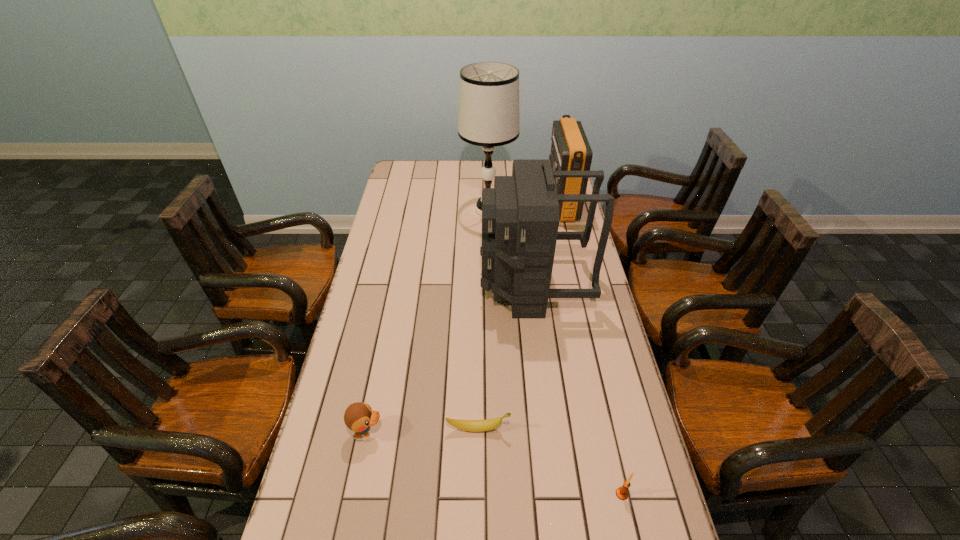
You are a GUI agent. You are given a task and a screenshot of the screen. Output one action in this format:
    pyautogui.click(x=<x>, y=<y>)
    Task: Click on the free space located on the front compartment of the fourth nearest object
    This screenshot has height=540, width=960.
    Given the screenshot: What is the action you would take?
    pyautogui.click(x=438, y=285)

Find the location of a particular element. This screenshot has width=960, height=540. free location located 0.350m on the front-facing side of the fourth shortest object is located at coordinates (469, 204).

Locate an element on the screen. The width and height of the screenshot is (960, 540). vacant area located on the front-facing side of the fourth shortest object is located at coordinates (462, 204).

You are a GUI agent. You are given a task and a screenshot of the screen. Output one action in this format:
    pyautogui.click(x=<x>, y=<y>)
    Task: Click on the vacant region located 0.220m on the front-facing side of the fourth shortest object
    This screenshot has width=960, height=540.
    Given the screenshot: What is the action you would take?
    pyautogui.click(x=498, y=204)

Locate an element on the screen. vacant space situated on the back of the candle_holder is located at coordinates 594,370.

The image size is (960, 540). What are the coordinates of `free spot located 0.200m on the front-facing side of the duck` in the screenshot? It's located at (460, 432).

Image resolution: width=960 pixels, height=540 pixels. Find the location of `blank area located at the stem of the banana`. blank area located at the stem of the banana is located at coordinates click(637, 429).

The height and width of the screenshot is (540, 960). Identify the location of object situated at the far edge. (570, 151).

Locate an element on the screen. This screenshot has height=540, width=960. object located in the left edge section of the desktop is located at coordinates (359, 417).

The width and height of the screenshot is (960, 540). I want to click on backpack at the right edge, so click(x=520, y=216).